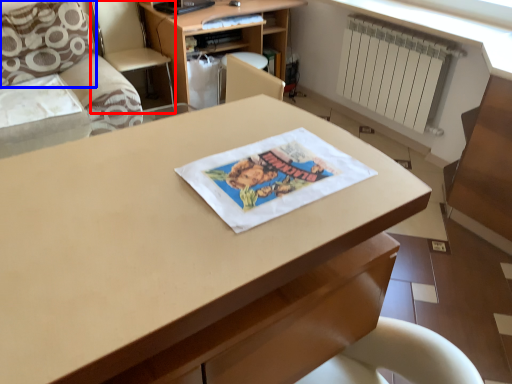
Question: Which point is closer to the camera, armchair (highlighted by a red box) or pillow (highlighted by a blue box)?

Choices:
 (A) armchair
 (B) pillow

Answer: (B)